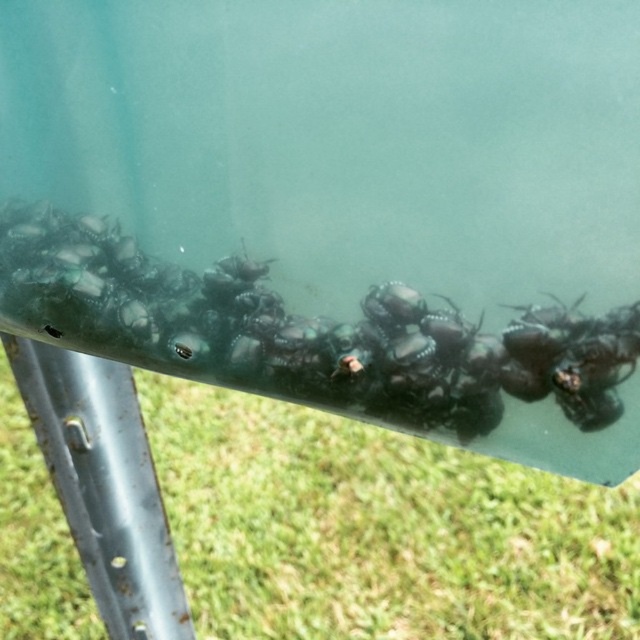
Question: Can you confirm if green grass at lower center is positioned to the left of green glossy snails at center?

Choices:
 (A) no
 (B) yes

Answer: (A)

Question: Among these objects, which one is farthest from the camera?

Choices:
 (A) green glossy snails at center
 (B) green grass at lower center

Answer: (B)

Question: Can you confirm if green grass at lower center is positioned below green glossy snails at center?

Choices:
 (A) no
 (B) yes

Answer: (B)

Question: Can you confirm if green grass at lower center is positioned to the right of green glossy snails at center?

Choices:
 (A) no
 (B) yes

Answer: (B)